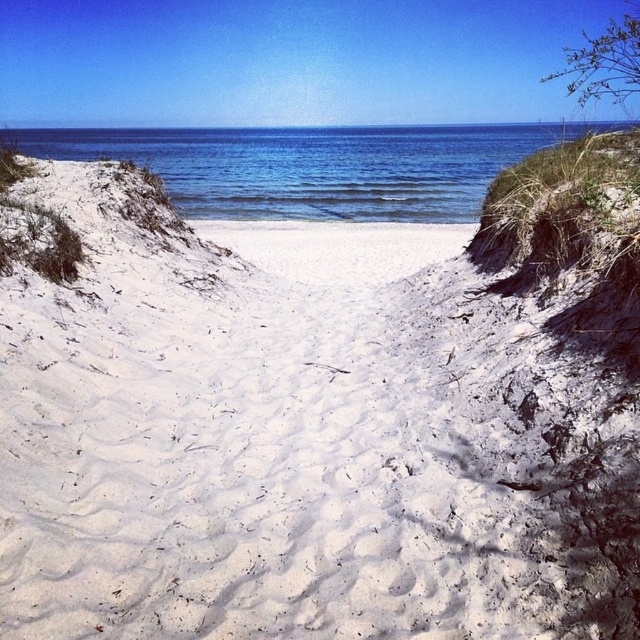
Can you confirm if blue water at center is positioned to the right of white sandy beach at center?

No, blue water at center is not to the right of white sandy beach at center.

Identify the location of blue water at center. (314, 166).